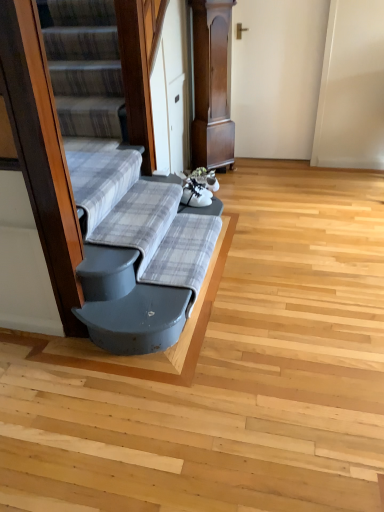
Question: Is plaid fabric couch at center, which is the first sheet from left to right, surrounding gray plaid fabric at lower left, the 2th sheet from the left?

Choices:
 (A) no
 (B) yes

Answer: (A)

Question: Is plaid fabric couch at center, arranged as the second sheet when viewed from the right, bigger than gray plaid fabric at lower left, which appears as the first sheet when viewed from the right?

Choices:
 (A) yes
 (B) no

Answer: (A)

Question: Considering the relative sizes of plaid fabric couch at center, arranged as the second sheet when viewed from the right, and gray plaid fabric at lower left, the 2th sheet from the left, in the image provided, is plaid fabric couch at center, arranged as the second sheet when viewed from the right, smaller than gray plaid fabric at lower left, the 2th sheet from the left,?

Choices:
 (A) yes
 (B) no

Answer: (B)

Question: Can you confirm if plaid fabric couch at center, which is the first sheet from left to right, is positioned to the right of gray plaid fabric at lower left, which appears as the first sheet when viewed from the right?

Choices:
 (A) no
 (B) yes

Answer: (A)

Question: Does plaid fabric couch at center, arranged as the second sheet when viewed from the right, have a greater width compared to gray plaid fabric at lower left, which appears as the first sheet when viewed from the right?

Choices:
 (A) yes
 (B) no

Answer: (B)

Question: From a real-world perspective, is plaid fabric couch at center, which is the first sheet from left to right, over gray plaid fabric at lower left, the 2th sheet from the left?

Choices:
 (A) no
 (B) yes

Answer: (B)

Question: Is gray plaid fabric at lower left, which appears as the first sheet when viewed from the right, behind plaid fabric couch at center, arranged as the second sheet when viewed from the right?

Choices:
 (A) yes
 (B) no

Answer: (A)

Question: Does gray plaid fabric at lower left, which appears as the first sheet when viewed from the right, have a lesser height compared to plaid fabric couch at center, which is the first sheet from left to right?

Choices:
 (A) yes
 (B) no

Answer: (A)

Question: From the image's perspective, is gray plaid fabric at lower left, the 2th sheet from the left, on top of plaid fabric couch at center, arranged as the second sheet when viewed from the right?

Choices:
 (A) yes
 (B) no

Answer: (B)

Question: Is gray plaid fabric at lower left, which appears as the first sheet when viewed from the right, to the right of plaid fabric couch at center, arranged as the second sheet when viewed from the right, from the viewer's perspective?

Choices:
 (A) no
 (B) yes

Answer: (B)

Question: Is the depth of gray plaid fabric at lower left, the 2th sheet from the left, less than that of plaid fabric couch at center, which is the first sheet from left to right?

Choices:
 (A) no
 (B) yes

Answer: (A)

Question: Is gray plaid fabric at lower left, which appears as the first sheet when viewed from the right, with plaid fabric couch at center, which is the first sheet from left to right?

Choices:
 (A) no
 (B) yes

Answer: (A)

Question: Is gray plaid fabric at lower left, which appears as the first sheet when viewed from the right, in front of or behind plaid fabric couch at center, which is the first sheet from left to right, in the image?

Choices:
 (A) behind
 (B) front

Answer: (A)